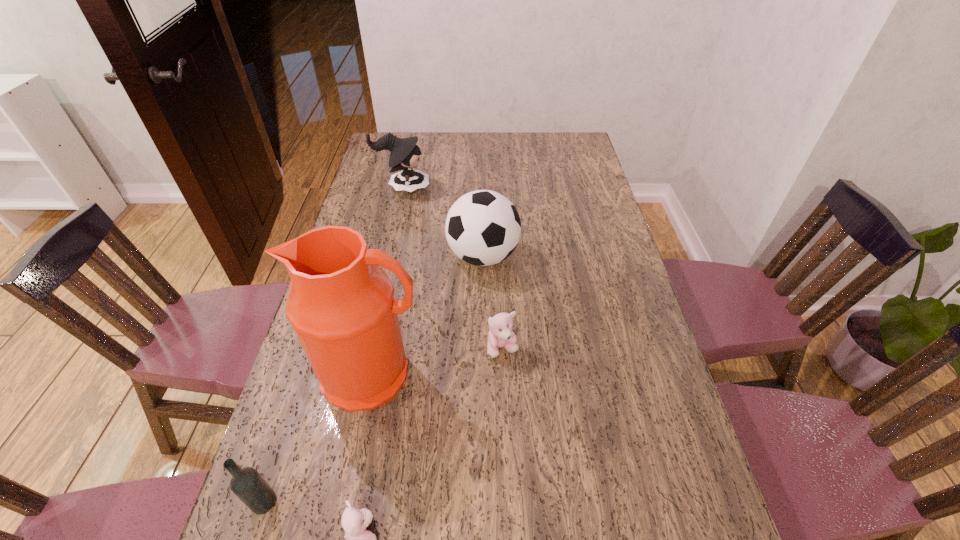
At what (x,y) coordinates should I click in order to perform the action: click on vacant space positioned 0.150m from the spout of the tallest object. Please return your answer as a coordinate pair (x, y). This screenshot has width=960, height=540. Looking at the image, I should click on (350, 482).

I want to click on vacant space positioned on the right of the leftmost object, so click(438, 502).

At what (x,y) coordinates should I click in order to perform the action: click on object located at the near edge. Please return your answer as a coordinate pair (x, y). Looking at the image, I should click on (247, 484).

Locate an element on the screen. doll present at the left edge is located at coordinates (404, 155).

This screenshot has height=540, width=960. Find the location of `water jug that is at the left edge`. water jug that is at the left edge is located at coordinates point(341,304).

The height and width of the screenshot is (540, 960). I want to click on vodka that is positioned at the left edge, so click(x=247, y=484).

Find the location of a particular element. This screenshot has height=540, width=960. object that is positioned at the near left corner is located at coordinates (247, 484).

What are the coordinates of `vacant region at the far edge of the desktop` in the screenshot? It's located at (480, 133).

At what (x,y) coordinates should I click in order to perform the action: click on vacant space at the near edge of the desktop. Please return your answer as a coordinate pair (x, y). Looking at the image, I should click on (381, 530).

This screenshot has height=540, width=960. In order to click on vacant area at the left edge of the desktop in this screenshot , I will do `click(396, 204)`.